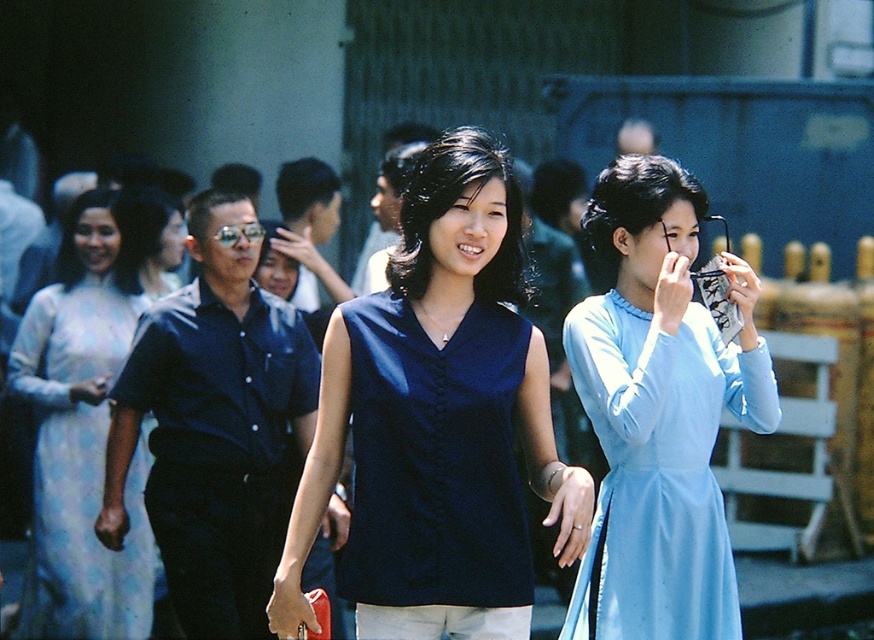
Does light blue silk dress at center have a greater height compared to navy blue fabric dress at center?

Indeed, light blue silk dress at center has a greater height compared to navy blue fabric dress at center.

Is light blue silk dress at center wider than navy blue fabric dress at center?

Yes.

Between point (688, 246) and point (481, 532), which one is positioned in front?

Point (481, 532) is more forward.

Image resolution: width=874 pixels, height=640 pixels. What are the coordinates of `light blue silk dress at center` in the screenshot? It's located at (659, 412).

Can you confirm if light blue silk dress at center is positioned above shiny blue shirt at center?

Yes.

Which is in front, point (664, 184) or point (165, 308)?

Point (664, 184)

Is point (733, 289) positioned in front of point (260, 433)?

Yes, point (733, 289) is closer to viewer.

Find the location of a particular element. The image size is (874, 640). light blue silk dress at center is located at coordinates (659, 412).

How distant is matte blue blouse at center from light blue silk dress at center?

matte blue blouse at center is 38.03 inches from light blue silk dress at center.

Does matte blue blouse at center have a larger size compared to light blue silk dress at center?

Indeed, matte blue blouse at center has a larger size compared to light blue silk dress at center.

Does point (491, 545) lie behind point (600, 432)?

No, (491, 545) is in front of (600, 432).

What are the coordinates of `matte blue blouse at center` in the screenshot? It's located at (439, 413).